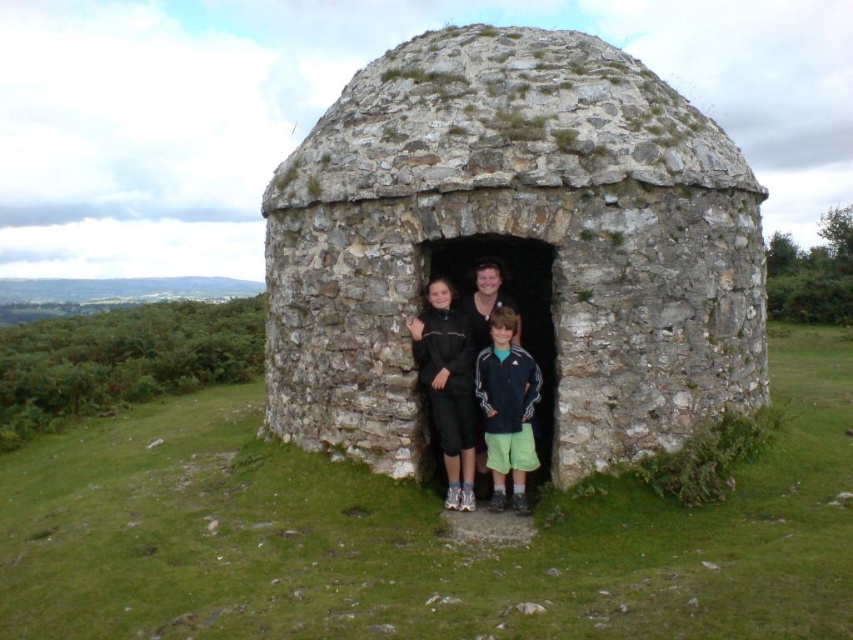
You are standing in front of the rough stone dome at center and want to take a photo of the dark blue adidas jacket at center. Which object is closer to your camera lens?

The rough stone dome at center is closer to the viewer than the dark blue adidas jacket at center, so it will appear closer to the camera lens.